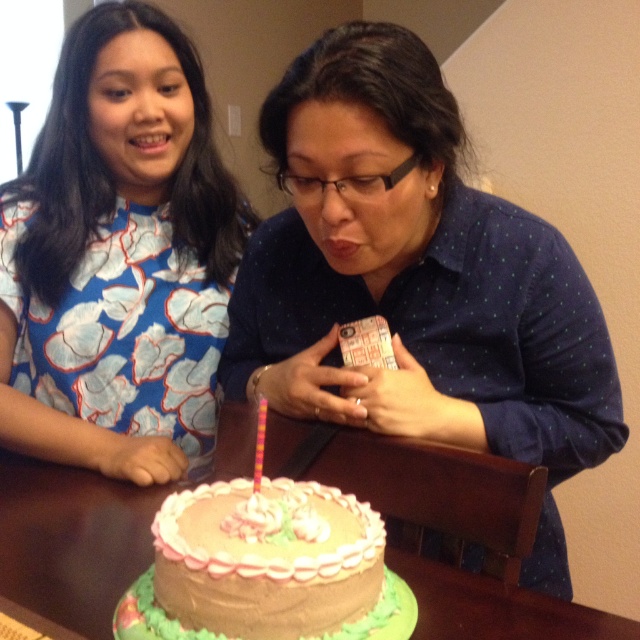
Question: Which object is farther from the camera taking this photo?

Choices:
 (A) multicolored plastic candle at center
 (B) smooth wooden table at center
 (C) chocolate frosted cake at center
 (D) matte blue shirt at center

Answer: (D)

Question: Can you confirm if blue floral dress at left is positioned to the left of smooth wooden table at center?

Choices:
 (A) no
 (B) yes

Answer: (B)

Question: Does matte blue shirt at center appear on the left side of blue floral dress at left?

Choices:
 (A) yes
 (B) no

Answer: (B)

Question: Which object is closer to the camera taking this photo?

Choices:
 (A) multicolored plastic candle at center
 (B) matte blue shirt at center

Answer: (A)

Question: Which object is the farthest from the multicolored plastic candle at center?

Choices:
 (A) matte blue shirt at center
 (B) chocolate frosted cake at center
 (C) smooth wooden table at center
 (D) blue floral dress at left

Answer: (D)

Question: Can you confirm if blue floral dress at left is wider than smooth wooden table at center?

Choices:
 (A) yes
 (B) no

Answer: (B)